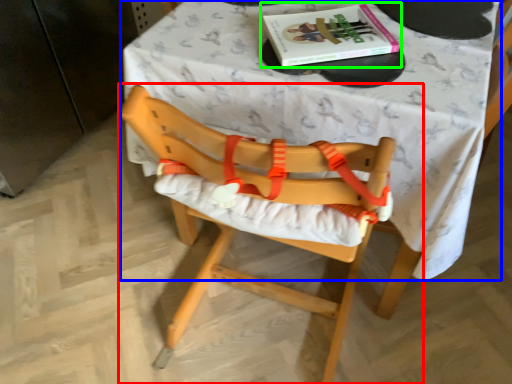
Question: Based on their relative distances, which object is farther from chair (highlighted by a red box)? Choose from table (highlighted by a blue box) and book (highlighted by a green box).

Choices:
 (A) table
 (B) book

Answer: (B)